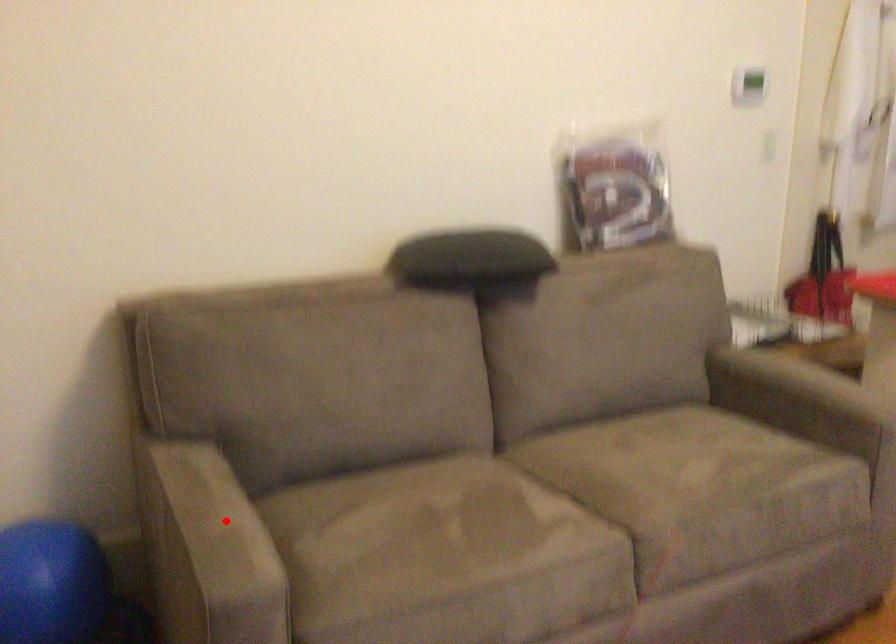
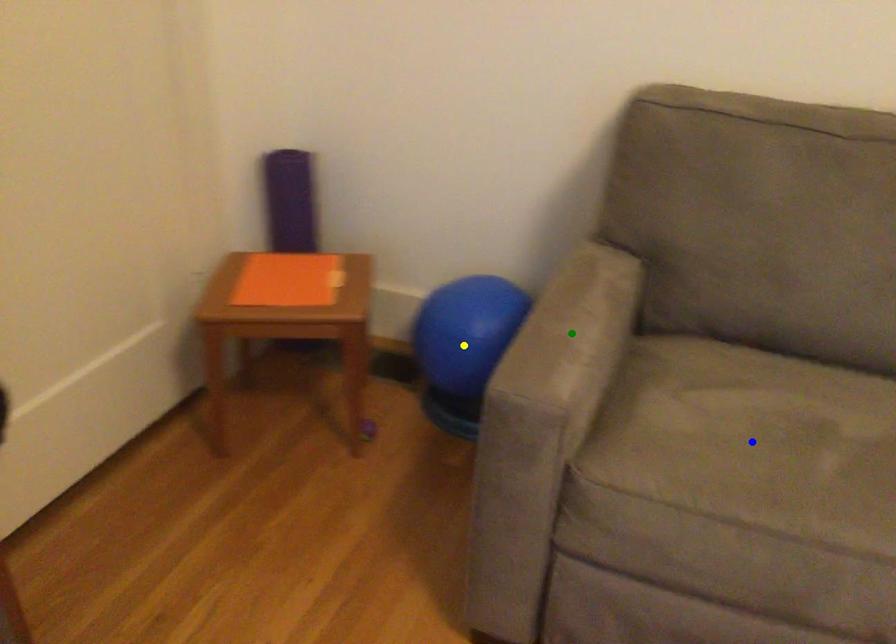
Question: I am providing you with two images of the same scene from different viewpoints. A red point is marked on the first image. You are given multiple points on the second image. In image 2, which mark is for the same physical point as the one in image 1?

Choices:
 (A) blue point
 (B) green point
 (C) yellow point

Answer: (B)